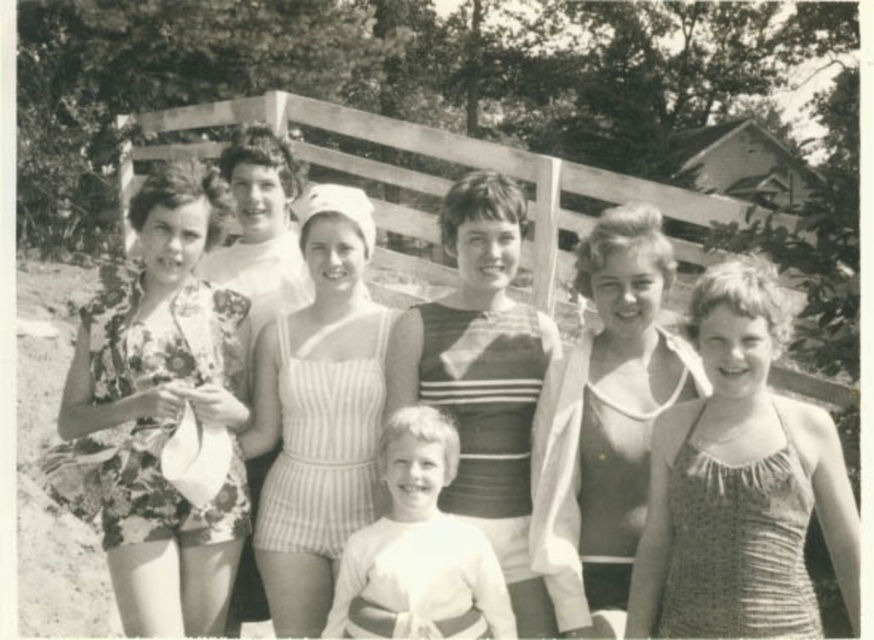
Is polka dot fabric swimsuit at center above striped fabric swimsuit at center?

No.

Is polka dot fabric swimsuit at center taller than striped fabric swimsuit at center?

In fact, polka dot fabric swimsuit at center may be shorter than striped fabric swimsuit at center.

Find the location of a particular element. This screenshot has width=874, height=640. polka dot fabric swimsuit at center is located at coordinates (740, 483).

Is floral fabric dress at left bigger than white cotton shirt at center?

Yes.

What do you see at coordinates (163, 406) in the screenshot? Image resolution: width=874 pixels, height=640 pixels. I see `floral fabric dress at left` at bounding box center [163, 406].

You are a GUI agent. You are given a task and a screenshot of the screen. Output one action in this format:
    pyautogui.click(x=<x>, y=<y>)
    Task: Click on the floral fabric dress at left
    
    Given the screenshot: What is the action you would take?
    pyautogui.click(x=163, y=406)

Does white striped swimsuit at center appear under white cotton shirt at center?

Actually, white striped swimsuit at center is above white cotton shirt at center.

Does white striped swimsuit at center have a smaller size compared to white cotton shirt at center?

No.

Which is in front, point (299, 220) or point (392, 573)?

Point (392, 573) is more forward.

The width and height of the screenshot is (874, 640). Find the location of `white striped swimsuit at center`. white striped swimsuit at center is located at coordinates (318, 412).